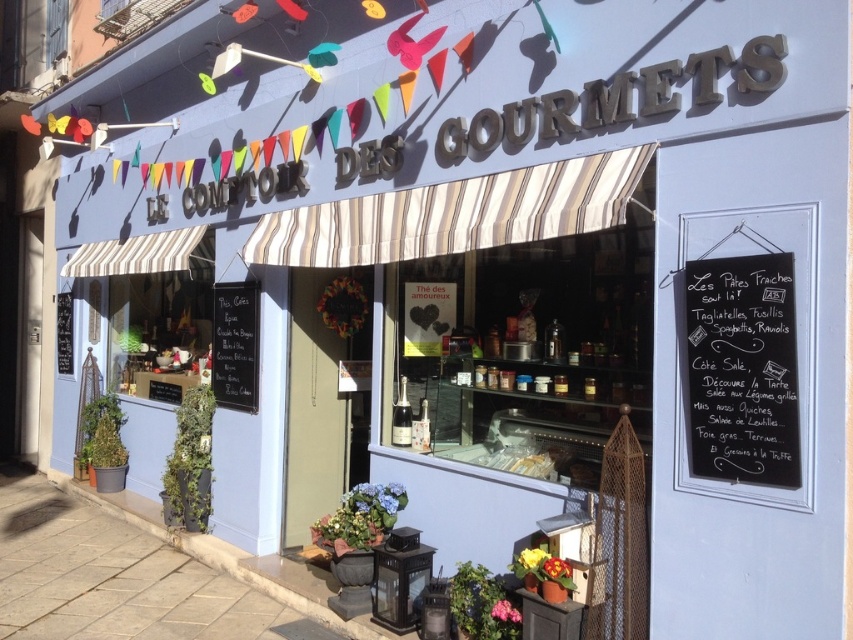
Question: Which point is farther to the camera?

Choices:
 (A) sandy beige paving stone at lower left
 (B) black chalkboard at upper right

Answer: (A)

Question: Is sandy beige paving stone at lower left below black chalkboard at upper right?

Choices:
 (A) yes
 (B) no

Answer: (A)

Question: Does sandy beige paving stone at lower left appear on the left side of black chalkboard at upper right?

Choices:
 (A) yes
 (B) no

Answer: (A)

Question: Does sandy beige paving stone at lower left appear on the left side of black chalkboard at upper right?

Choices:
 (A) no
 (B) yes

Answer: (B)

Question: Which of the following is the closest to the observer?

Choices:
 (A) (96, 554)
 (B) (776, 403)

Answer: (B)